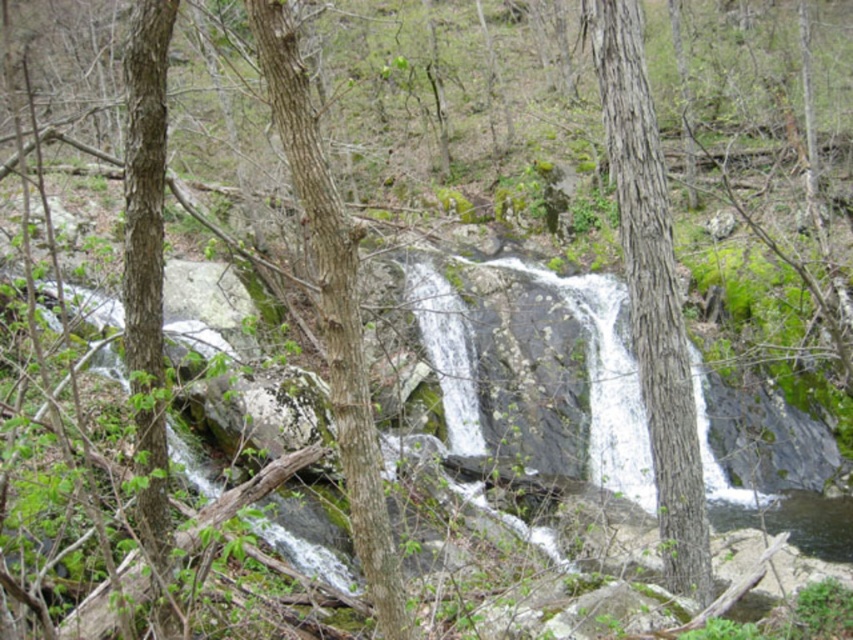
Does point (604, 68) lie in front of point (372, 595)?

No, it is behind (372, 595).

Does brown rough bark tree at center appear under smooth bark tree at center?

No.

Identify the location of brown rough bark tree at center. (653, 292).

Is point (635, 141) in front of point (164, 93)?

That is False.

Who is more forward, (677, 356) or (170, 28)?

Point (170, 28) is more forward.

Locate an element on the screen. This screenshot has height=640, width=853. brown rough bark tree at center is located at coordinates [653, 292].

Is point (267, 65) positioned before point (149, 170)?

Yes.

Is smooth bark tree at center behind smooth bark tree at left?

No, smooth bark tree at center is in front of smooth bark tree at left.

Between point (310, 148) and point (137, 244), which one is positioned behind?

The point (137, 244) is behind.

Find the location of a particular element. smooth bark tree at center is located at coordinates (334, 310).